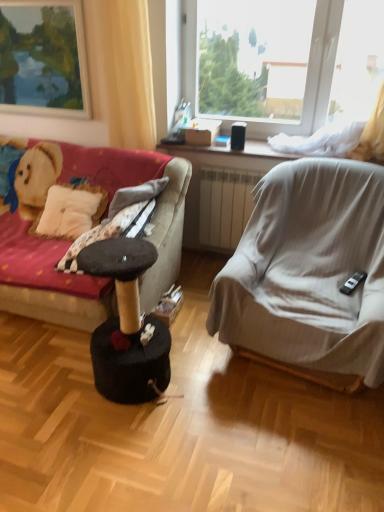
Question: Is black felt cat tree at center directly adjacent to yellow fabric curtain at upper left?

Choices:
 (A) no
 (B) yes

Answer: (A)

Question: Does black felt cat tree at center have a greater width compared to yellow fabric curtain at upper left?

Choices:
 (A) yes
 (B) no

Answer: (A)

Question: Is black felt cat tree at center taller than yellow fabric curtain at upper left?

Choices:
 (A) no
 (B) yes

Answer: (A)

Question: From the image's perspective, does black felt cat tree at center appear lower than yellow fabric curtain at upper left?

Choices:
 (A) yes
 (B) no

Answer: (A)

Question: Could you tell me if black felt cat tree at center is turned towards yellow fabric curtain at upper left?

Choices:
 (A) yes
 (B) no

Answer: (B)

Question: From their relative heights in the image, would you say black felt cat tree at center is taller or shorter than velvet fabric couch at left?

Choices:
 (A) short
 (B) tall

Answer: (A)

Question: Considering the positions of black felt cat tree at center and velvet fabric couch at left in the image, is black felt cat tree at center wider or thinner than velvet fabric couch at left?

Choices:
 (A) thin
 (B) wide

Answer: (A)

Question: From a real-world perspective, relative to velvet fabric couch at left, is black felt cat tree at center vertically above or below?

Choices:
 (A) below
 (B) above

Answer: (A)

Question: Is black felt cat tree at center to the left or to the right of velvet fabric couch at left in the image?

Choices:
 (A) right
 (B) left

Answer: (A)

Question: Would you say transparent plastic window at upper center is inside or outside light gray fabric chair at right?

Choices:
 (A) outside
 (B) inside

Answer: (A)

Question: From the image's perspective, is transparent plastic window at upper center above or below light gray fabric chair at right?

Choices:
 (A) below
 (B) above

Answer: (B)

Question: Considering the positions of point (254, 57) and point (365, 248), is point (254, 57) closer or farther from the camera than point (365, 248)?

Choices:
 (A) closer
 (B) farther

Answer: (B)

Question: From their relative heights in the image, would you say transparent plastic window at upper center is taller or shorter than light gray fabric chair at right?

Choices:
 (A) short
 (B) tall

Answer: (A)

Question: Is matte wooden picture frame at upper left inside the boundaries of black felt cat tree at center, or outside?

Choices:
 (A) outside
 (B) inside

Answer: (A)

Question: Does point (11, 20) appear closer or farther from the camera than point (91, 353)?

Choices:
 (A) closer
 (B) farther

Answer: (B)